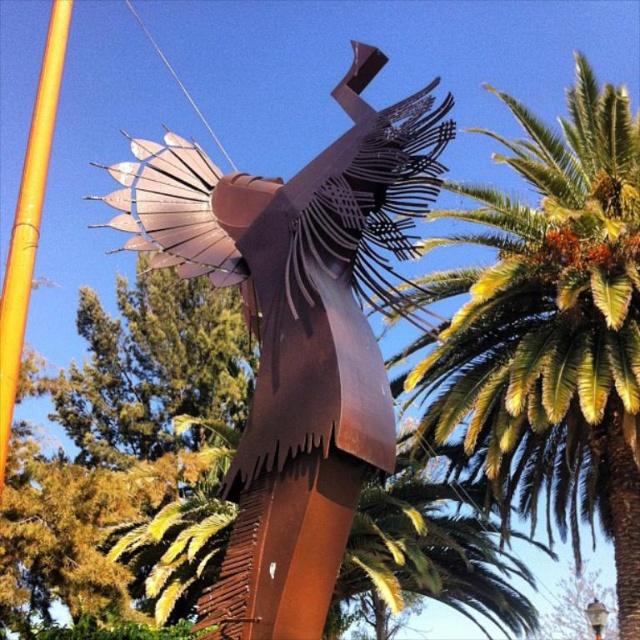
You are a photographer planning to capture the entire sculpture and its surroundings. Given that the green leafy palm tree at upper right and the orange bamboo pole at left are in the frame, which object would you need to adjust your camera angle to avoid blocking the sculpture?

The green leafy palm tree at upper right is taller than the orange bamboo pole at left, so you would need to adjust your camera angle to avoid the green leafy palm tree at upper right blocking the sculpture.

You are standing in front of a metal sculpture in a garden. There is a point at coordinates (296, 332). What object is located at that point?

The point at coordinates (296, 332) corresponds to the rusty metal sculpture at center.